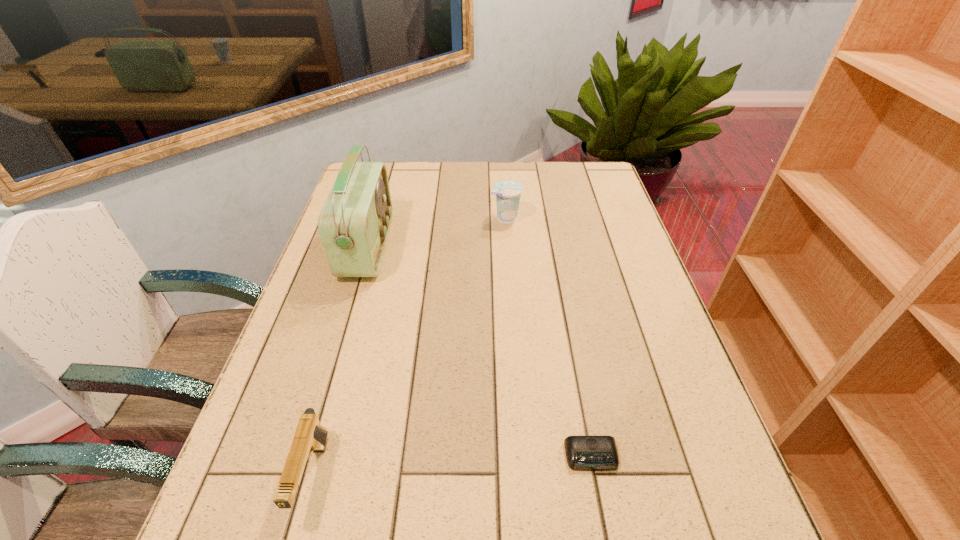
Locate an element on the screen. This screenshot has width=960, height=540. pistol situated at the left edge is located at coordinates (309, 436).

Where is `object that is at the near left corner`? The image size is (960, 540). object that is at the near left corner is located at coordinates (309, 436).

In the image, there is a desktop. At what (x,y) coordinates should I click in order to perform the action: click on free space at the far edge. Please return your answer as a coordinate pair (x, y). Looking at the image, I should click on (423, 163).

The width and height of the screenshot is (960, 540). Find the location of `free space at the left edge`. free space at the left edge is located at coordinates (284, 359).

Find the location of a particular element. Image resolution: width=960 pixels, height=540 pixels. vacant space at the right edge is located at coordinates (703, 410).

The width and height of the screenshot is (960, 540). Identify the location of free space at the far left corner of the desktop. (396, 188).

At what (x,y) coordinates should I click in order to perform the action: click on free space between the shortest object and the second object from right to left. Please return your answer as a coordinate pair (x, y). The width and height of the screenshot is (960, 540). Looking at the image, I should click on (548, 337).

Where is `free spot between the rightmost object and the pistol`? free spot between the rightmost object and the pistol is located at coordinates (452, 466).

The image size is (960, 540). Find the location of `unoccupied position between the second object from right to left and the rightmost object`. unoccupied position between the second object from right to left and the rightmost object is located at coordinates (548, 337).

Identify the location of free space between the radio receiver and the yogurt. (437, 233).